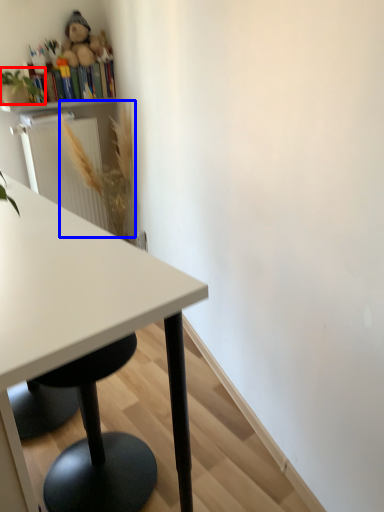
Question: Among these objects, which one is nearest to the camera, plant (highlighted by a red box) or flower (highlighted by a blue box)?

Choices:
 (A) plant
 (B) flower

Answer: (A)